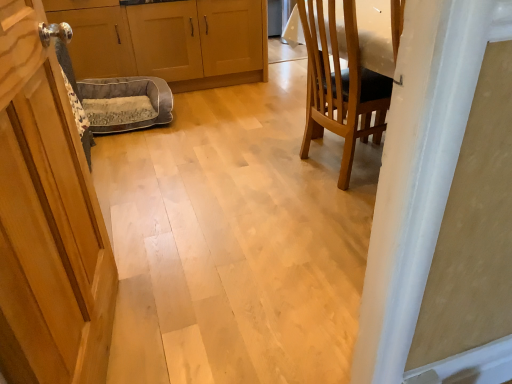
Question: Considering the relative sizes of matte wood cabinets at center, acting as the 2th cabinetry starting from the left, and gray fabric dog bed at center in the image provided, is matte wood cabinets at center, acting as the 2th cabinetry starting from the left, shorter than gray fabric dog bed at center?

Choices:
 (A) yes
 (B) no

Answer: (B)

Question: Is matte wood cabinets at center, positioned as the first cabinetry in right-to-left order, located outside gray fabric dog bed at center?

Choices:
 (A) yes
 (B) no

Answer: (A)

Question: Does matte wood cabinets at center, acting as the 2th cabinetry starting from the left, have a smaller size compared to gray fabric dog bed at center?

Choices:
 (A) no
 (B) yes

Answer: (A)

Question: From the image's perspective, is matte wood cabinets at center, positioned as the first cabinetry in right-to-left order, below gray fabric dog bed at center?

Choices:
 (A) no
 (B) yes

Answer: (A)

Question: From a real-world perspective, does matte wood cabinets at center, acting as the 2th cabinetry starting from the left, sit lower than gray fabric dog bed at center?

Choices:
 (A) no
 (B) yes

Answer: (A)

Question: Does matte wood cabinets at center, positioned as the first cabinetry in right-to-left order, appear on the right side of gray fabric dog bed at center?

Choices:
 (A) yes
 (B) no

Answer: (A)

Question: From a real-world perspective, does wooden cabinet at left, the first cabinetry when ordered from left to right, sit lower than wooden chair at right?

Choices:
 (A) yes
 (B) no

Answer: (A)

Question: Is wooden cabinet at left, the first cabinetry when ordered from left to right, taller than wooden chair at right?

Choices:
 (A) no
 (B) yes

Answer: (A)

Question: Is wooden cabinet at left, which appears as the second cabinetry when viewed from the right, positioned beyond the bounds of wooden chair at right?

Choices:
 (A) yes
 (B) no

Answer: (A)

Question: Does wooden cabinet at left, which appears as the second cabinetry when viewed from the right, contain wooden chair at right?

Choices:
 (A) no
 (B) yes

Answer: (A)

Question: From a real-world perspective, is wooden cabinet at left, the first cabinetry when ordered from left to right, on wooden chair at right?

Choices:
 (A) yes
 (B) no

Answer: (B)

Question: Is wooden cabinet at left, which appears as the second cabinetry when viewed from the right, facing towards wooden chair at right?

Choices:
 (A) no
 (B) yes

Answer: (A)

Question: Is gray fabric dog bed at center at the right side of wooden cabinet at left, the first cabinetry when ordered from left to right?

Choices:
 (A) no
 (B) yes

Answer: (B)